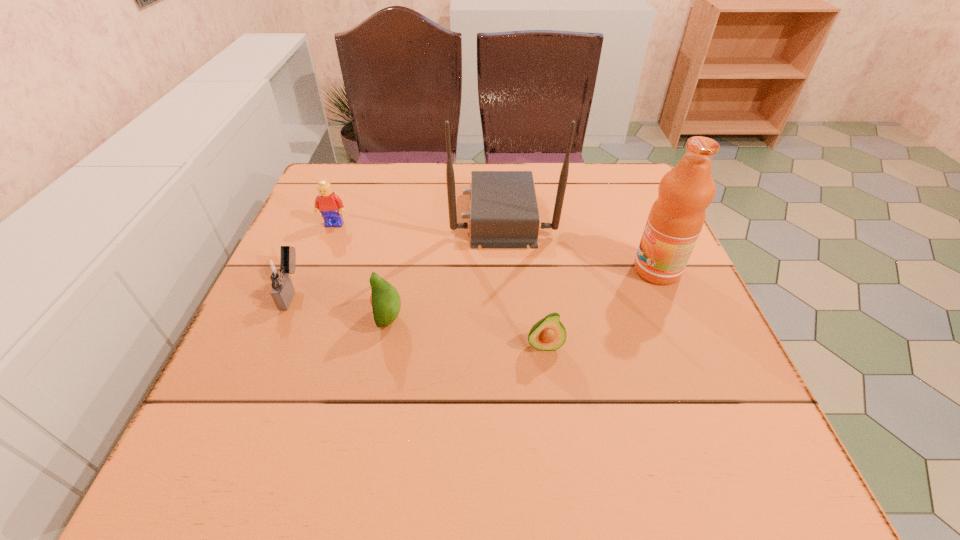
Identify the location of object that is the second nearest to the fruit juice. (548, 334).

Locate an element on the screen. The width and height of the screenshot is (960, 540). vacant space that satisfies the following two spatial constraints: 1. on the back of the router to connect cables; 2. on the front-facing side of the Lego is located at coordinates (503, 224).